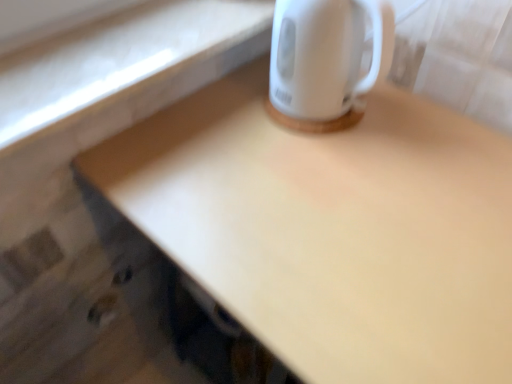
Question: From a real-world perspective, is matte white desk at upper right located beneath white glossy electric kettle at upper right?

Choices:
 (A) yes
 (B) no

Answer: (A)

Question: From the image's perspective, is matte white desk at upper right on top of white glossy electric kettle at upper right?

Choices:
 (A) no
 (B) yes

Answer: (A)

Question: Is matte white desk at upper right at the left side of white glossy electric kettle at upper right?

Choices:
 (A) yes
 (B) no

Answer: (B)

Question: Is matte white desk at upper right wider than white glossy electric kettle at upper right?

Choices:
 (A) yes
 (B) no

Answer: (A)

Question: Can you confirm if matte white desk at upper right is taller than white glossy electric kettle at upper right?

Choices:
 (A) yes
 (B) no

Answer: (A)

Question: Is matte white desk at upper right turned away from white glossy electric kettle at upper right?

Choices:
 (A) no
 (B) yes

Answer: (A)

Question: Is white glossy electric kettle at upper right outside matte white desk at upper right?

Choices:
 (A) yes
 (B) no

Answer: (A)

Question: Is white glossy electric kettle at upper right not close to matte white desk at upper right?

Choices:
 (A) yes
 (B) no

Answer: (B)

Question: Could you tell me if white glossy electric kettle at upper right is turned towards matte white desk at upper right?

Choices:
 (A) yes
 (B) no

Answer: (B)

Question: Is white glossy electric kettle at upper right beside matte white desk at upper right?

Choices:
 (A) yes
 (B) no

Answer: (B)

Question: Considering the relative sizes of white glossy electric kettle at upper right and matte white desk at upper right in the image provided, is white glossy electric kettle at upper right bigger than matte white desk at upper right?

Choices:
 (A) no
 (B) yes

Answer: (A)

Question: Could matte white desk at upper right be considered to be inside white glossy electric kettle at upper right?

Choices:
 (A) yes
 (B) no

Answer: (B)

Question: Based on their positions, is matte white desk at upper right located to the left or right of white glossy electric kettle at upper right?

Choices:
 (A) left
 (B) right

Answer: (B)